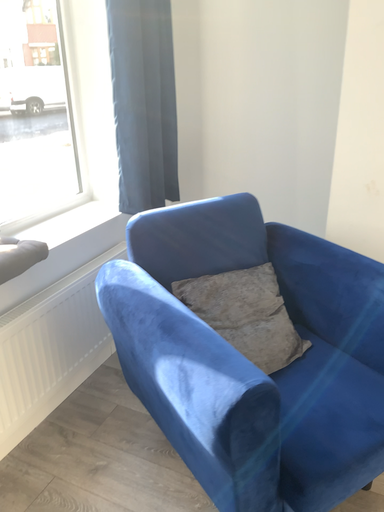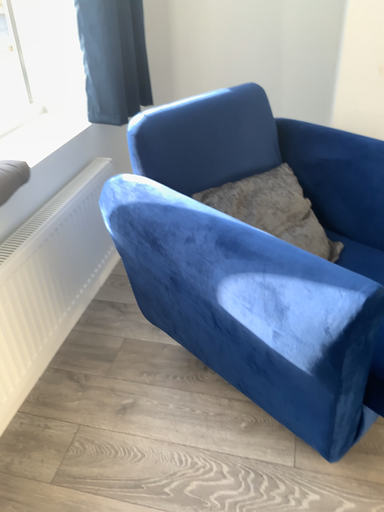
Question: Which way did the camera rotate in the video?

Choices:
 (A) rotated upward
 (B) rotated downward

Answer: (B)